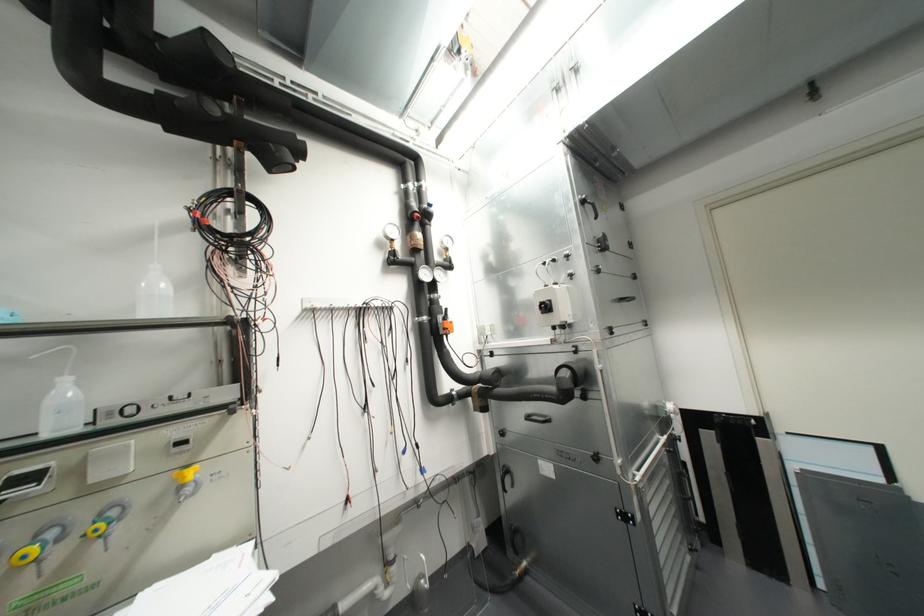
You are a GUI agent. You are given a task and a screenshot of the screen. Output one action in this format:
    pyautogui.click(x=<x>, y=<y>)
    Task: Click on the white rotary switch
    The height and width of the screenshot is (616, 924).
    Given the screenshot: What is the action you would take?
    pyautogui.click(x=544, y=306)